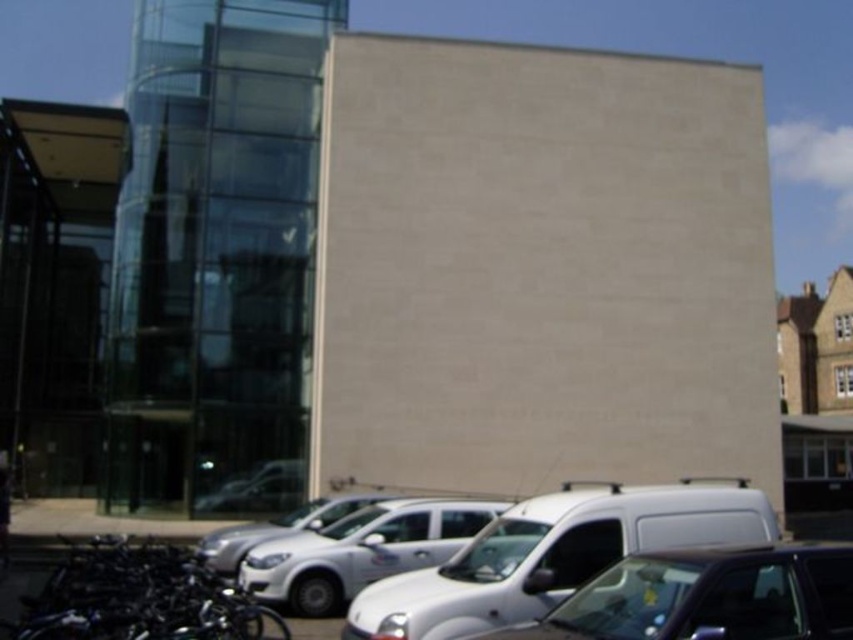
Question: Estimate the real-world distances between objects in this image. Which object is closer to the matte white van at lower center?

Choices:
 (A) white matte car at center
 (B) white matte van at lower center

Answer: (B)

Question: Which object appears closest to the camera in this image?

Choices:
 (A) white matte van at lower center
 (B) black matte bicycles at lower left
 (C) silver metallic car at center
 (D) matte white van at lower center

Answer: (D)

Question: Can you confirm if white matte van at lower center is positioned to the left of silver metallic car at center?

Choices:
 (A) no
 (B) yes

Answer: (A)

Question: Does white matte van at lower center have a larger size compared to matte white van at lower center?

Choices:
 (A) no
 (B) yes

Answer: (B)

Question: Which object appears farthest from the camera in this image?

Choices:
 (A) black matte bicycles at lower left
 (B) white matte van at lower center

Answer: (B)

Question: Can you confirm if black matte bicycles at lower left is positioned to the right of silver metallic car at center?

Choices:
 (A) yes
 (B) no

Answer: (B)